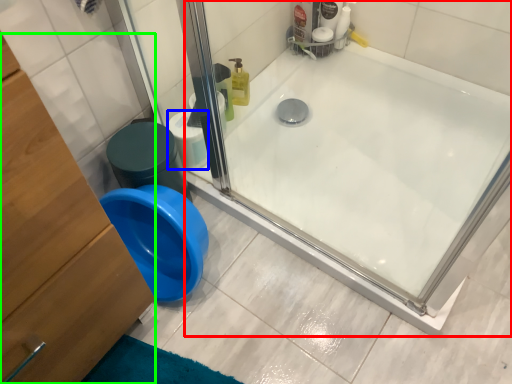
Question: Which object is the farthest from bathtub (highlighted by a red box)? Choose among these: toilet paper (highlighted by a blue box) or dresser (highlighted by a green box).

Choices:
 (A) toilet paper
 (B) dresser

Answer: (B)